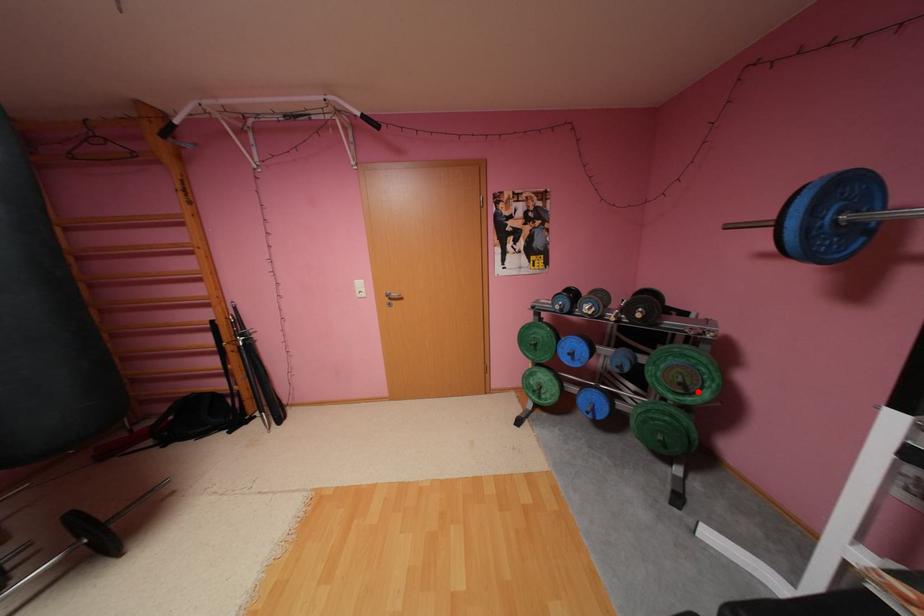
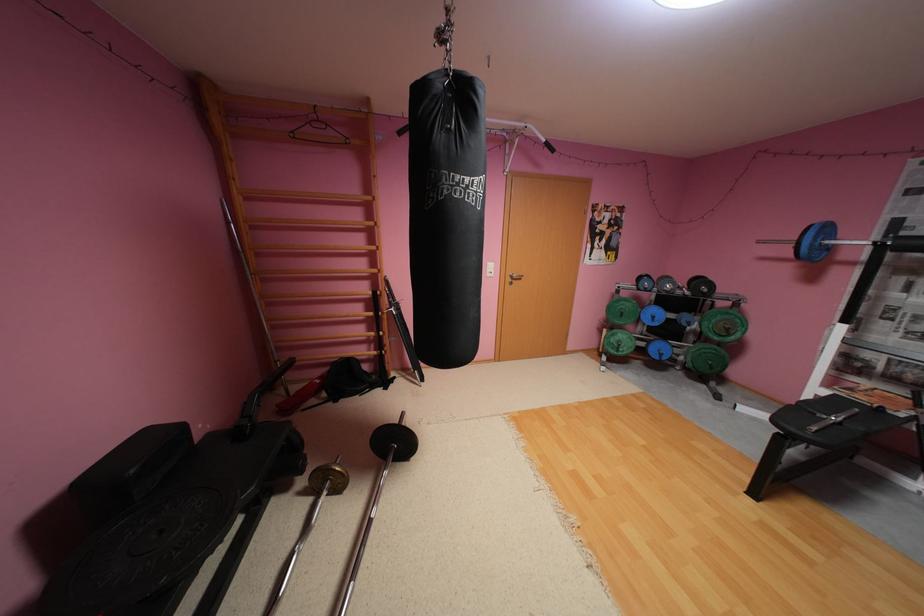
Find the pixel in the second image that matches the highlighted location in the first image.

(737, 334)